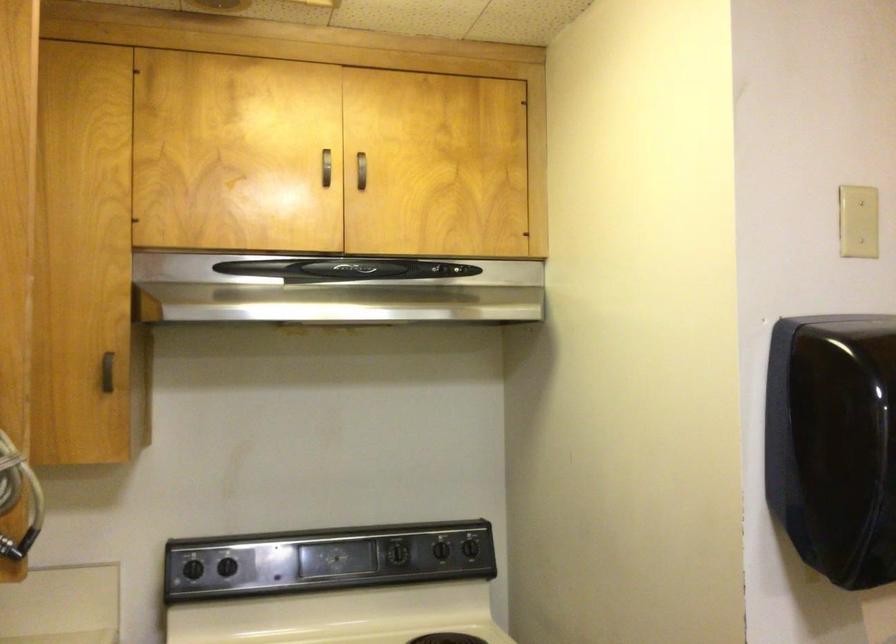
At what (x,y) coordinates should I click in order to perform the action: click on range hood switch. Please return your answer as a coordinate pair (x, y). The width and height of the screenshot is (896, 644). Looking at the image, I should click on pos(545,456).